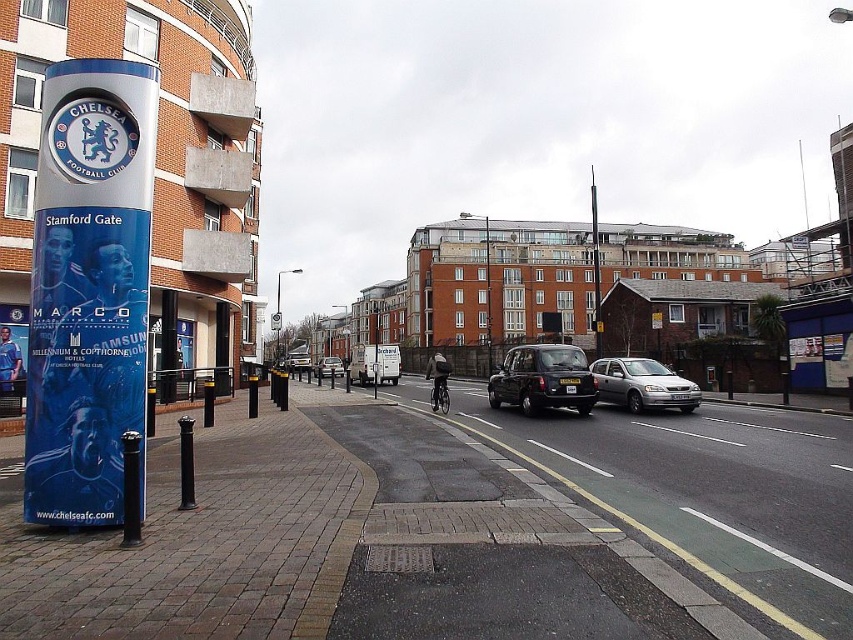
Can you confirm if silver metallic hatchback at center is taller than silver metallic van at center?

No.

In the scene shown: Does silver metallic hatchback at center have a smaller size compared to silver metallic van at center?

Indeed, silver metallic hatchback at center has a smaller size compared to silver metallic van at center.

Which is behind, point (611, 385) or point (325, 356)?

The point (325, 356) is more distant.

Identify the location of silver metallic hatchback at center. This screenshot has width=853, height=640. (642, 385).

What do you see at coordinates (595, 266) in the screenshot? This screenshot has width=853, height=640. I see `smooth metallic pole at center` at bounding box center [595, 266].

Can you confirm if smooth metallic pole at center is wider than silver metallic van at center?

Yes, smooth metallic pole at center is wider than silver metallic van at center.

Locate an element on the screen. The width and height of the screenshot is (853, 640). smooth metallic pole at center is located at coordinates (595, 266).

This screenshot has width=853, height=640. I want to click on smooth metallic pole at center, so click(595, 266).

Measure the distance between silver metallic hatchback at center and camera.

18.24 meters

Who is more distant from viewer, [683,392] or [590,221]?

The point [590,221] is more distant.

I want to click on silver metallic hatchback at center, so click(642, 385).